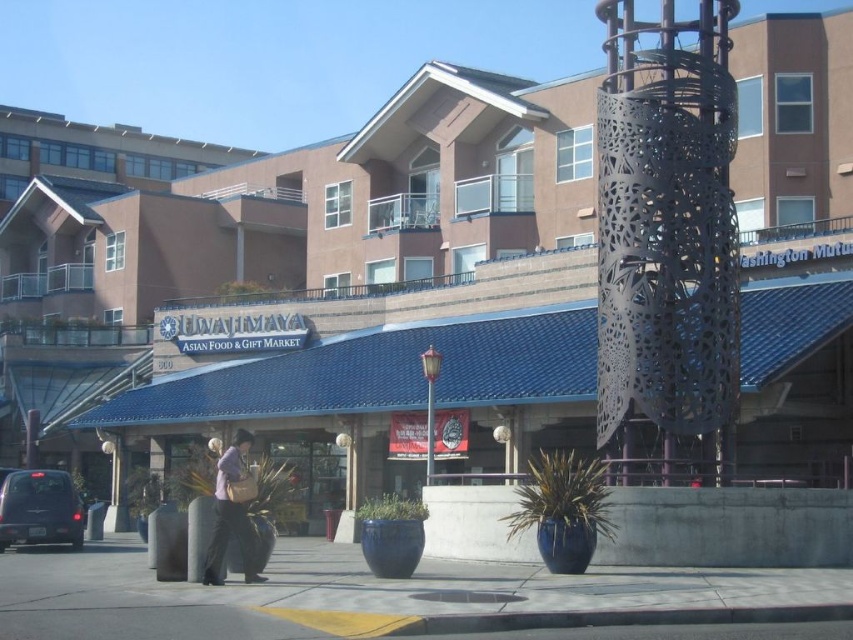
You are a delivery person trying to park your motorcycle between the black perforated metal tower at center and the gray concrete pavement at lower center. Can you safely park there without blocking the tower?

The black perforated metal tower at center is positioned over the gray concrete pavement at lower center, meaning there is no space between them for parking. You cannot park your motorcycle there without blocking the tower.

You are a delivery person who needs to park your matte black van at lower left near the light purple fabric bag at lower center. Based on the scene, can you park the van directly in front of the bag?

The matte black van at lower left is located below light purple fabric bag at lower center, so yes, the van can be parked directly in front of the bag since it is positioned lower.

You are a delivery person approaching the UWATIMAYA ASIAN FOOD AND GIFT MARKET. You see the black perforated metal tower at center and the gray concrete pavement at lower center. Which object is located to the right side of the other?

The black perforated metal tower at center is to the right of the gray concrete pavement at lower center.